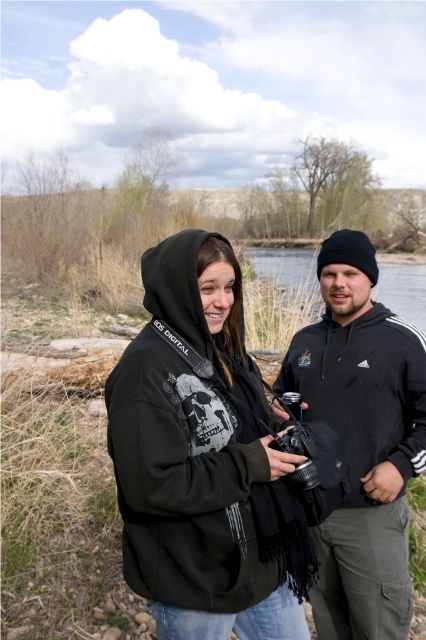
Does black matte hoodie at center have a greater height compared to black fleece jacket at right?

Incorrect, black matte hoodie at center's height is not larger of black fleece jacket at right's.

Between black matte hoodie at center and black fleece jacket at right, which one appears on the left side from the viewer's perspective?

From the viewer's perspective, black matte hoodie at center appears more on the left side.

Is point (164, 285) less distant than point (376, 582)?

Yes.

Identify the location of black matte hoodie at center. The width and height of the screenshot is (426, 640). (195, 500).